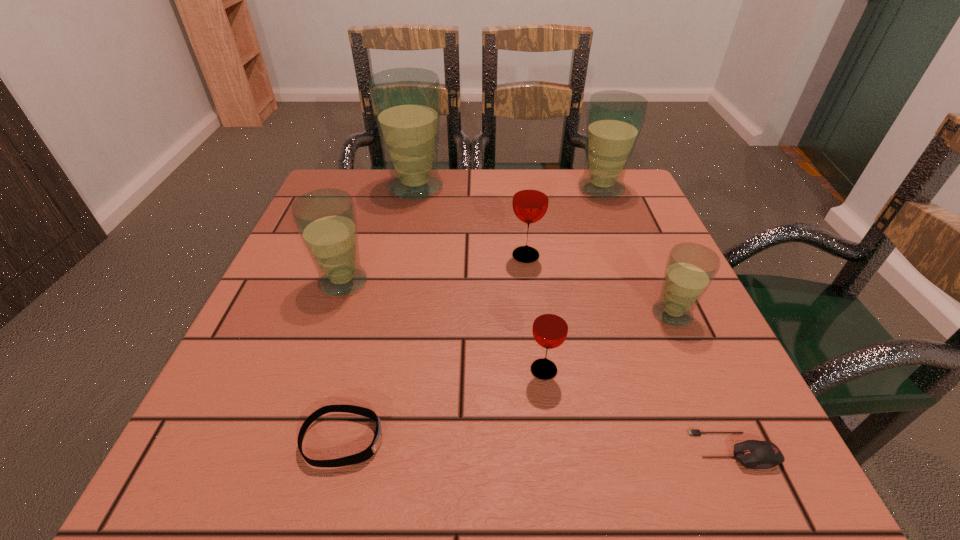
This screenshot has height=540, width=960. What are the coordinates of `the biggest blue glass` in the screenshot? It's located at (406, 102).

Where is `the tallest object`? the tallest object is located at coordinates (406, 102).

At what (x,y) coordinates should I click in order to perform the action: click on the second biggest blue glass. Please return your answer as a coordinate pair (x, y). Looking at the image, I should click on (615, 118).

I want to click on the second tallest glass, so click(x=615, y=118).

Identify the location of the farther red glass. (530, 201).

Where is `the second smallest blue glass`? Image resolution: width=960 pixels, height=540 pixels. the second smallest blue glass is located at coordinates 325,219.

At what (x,y) coordinates should I click in order to perform the action: click on the smallest blue glass. Please return your answer as a coordinate pair (x, y). The image size is (960, 540). Looking at the image, I should click on (690, 268).

Find the location of `the nearest glass`. the nearest glass is located at coordinates (550, 327).

Locate an element on the screen. Image resolution: width=960 pixels, height=540 pixels. the nearer red glass is located at coordinates (550, 327).

You are a GUI agent. You are given a task and a screenshot of the screen. Output one action in this format:
    pyautogui.click(x=<x>, y=<y>)
    Task: Click on the wristband
    The image size is (960, 540).
    Given the screenshot: What is the action you would take?
    pyautogui.click(x=363, y=456)